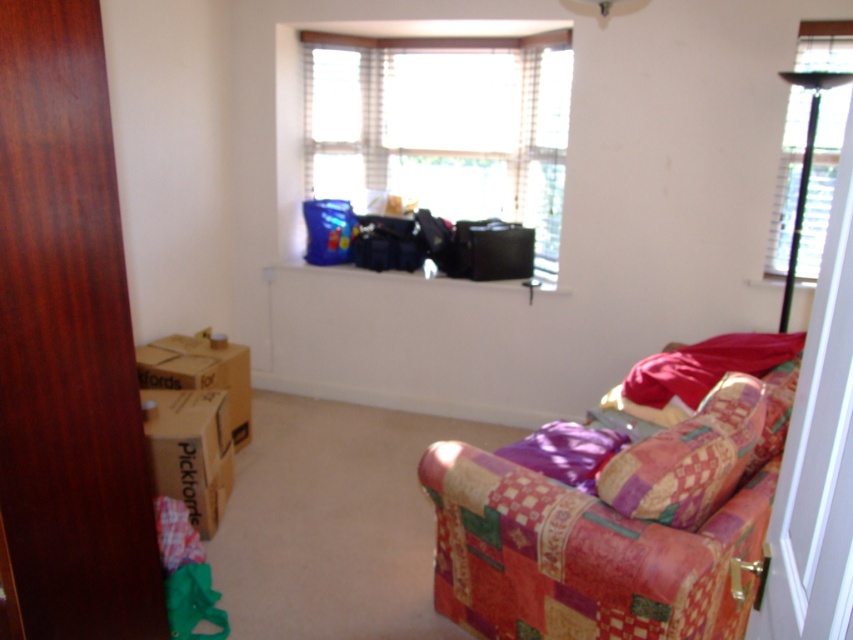
Question: Which point is farther to the camera?

Choices:
 (A) brown cardboard box at lower left
 (B) cardboard box at lower left
 (C) translucent plastic bags at upper center
 (D) patchwork fabric armchair at lower right

Answer: (C)

Question: Can you confirm if transparent glass window at upper right is thinner than brown cardboard box at lower left?

Choices:
 (A) yes
 (B) no

Answer: (A)

Question: Does transparent glass window at upper right have a lesser width compared to cardboard box at lower left?

Choices:
 (A) yes
 (B) no

Answer: (B)

Question: Which point is closer to the camera?

Choices:
 (A) (173, 381)
 (B) (524, 516)

Answer: (B)

Question: Can you confirm if transparent glass window at upper right is smaller than brown cardboard box at lower left?

Choices:
 (A) yes
 (B) no

Answer: (B)

Question: Which object appears farthest from the camera in this image?

Choices:
 (A) brown cardboard box at lower left
 (B) patchwork fabric pillow at lower right

Answer: (A)